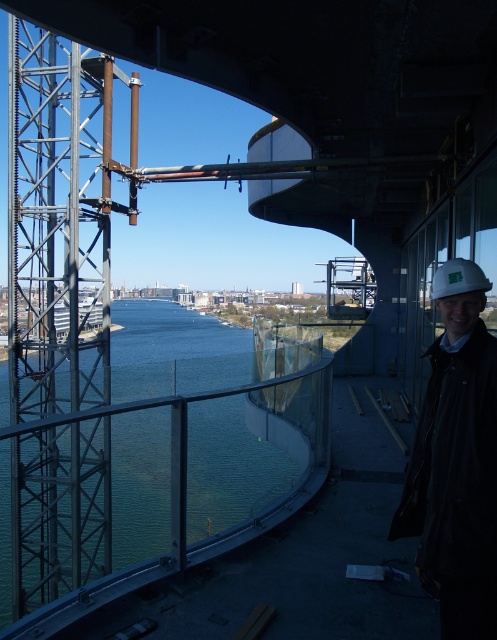
You are a safety inspector on the construction site. You see the clear glass water at center and the white hard hat at right. Which object is bigger in size?

The clear glass water at center is larger in size than the white hard hat at right.

You are standing on the platform near the white hard hat at right. You want to reach the clear glass water at center without getting wet. Is there enough space between them to walk safely?

The clear glass water at center is 6.94 meters from the white hard hat at right. Since the distance is more than sufficient for a person to walk around without stepping into the water, you can safely reach the area near the clear glass water at center while staying on the platform.

You are standing on the modern architectural structure overlooking the water. You want to take a photo of the clear glass water at center. Where should you aim your camera to capture it?

The clear glass water at center is located at point coordinates of 0.731 on the x axis and 0.463 on the y axis, so aim your camera towards those coordinates to capture it.